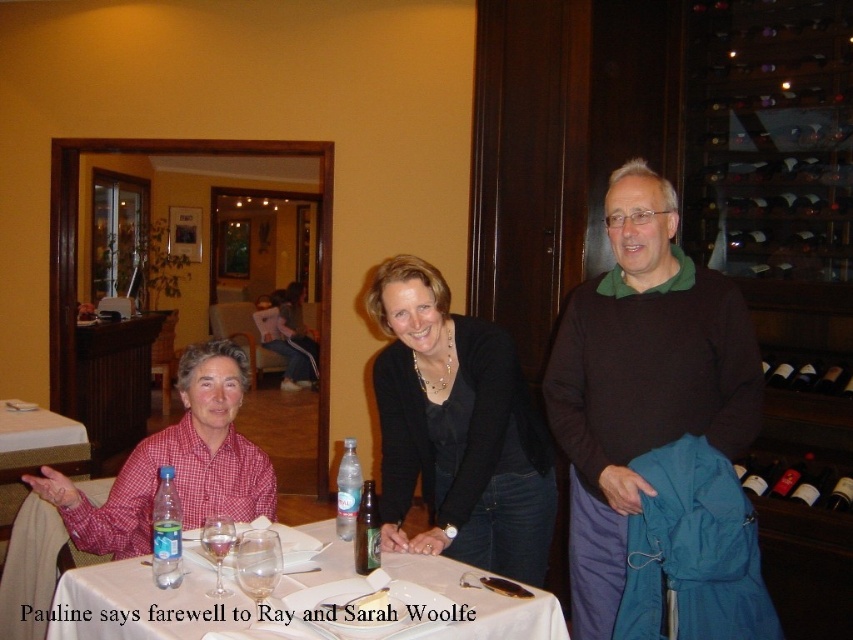
Which is more to the right, matte black jacket at center or clear glass wine glass at table center?

Positioned to the right is matte black jacket at center.

Between matte black jacket at center and clear glass wine glass at table center, which one has less height?

clear glass wine glass at table center

Between point (759, 397) and point (248, 568), which one is positioned in front?

Positioned in front is point (248, 568).

You are a GUI agent. You are given a task and a screenshot of the screen. Output one action in this format:
    pyautogui.click(x=<x>, y=<y>)
    Task: Click on the matte black jacket at center
    This screenshot has width=853, height=640.
    Given the screenshot: What is the action you would take?
    pyautogui.click(x=659, y=412)

Is clear glass wine glass at table center thinner than transparent glass at table center?

No.

Is point (257, 532) positioned before point (209, 536)?

No, (257, 532) is further to viewer.

At what (x,y) coordinates should I click in order to perform the action: click on clear glass wine glass at table center. Please return your answer as a coordinate pair (x, y). Image resolution: width=853 pixels, height=640 pixels. Looking at the image, I should click on (257, 564).

Does dark wood wine rack at right have a lesser height compared to dark brown glass wine bottle at right?

No.

Locate an element on the screen. This screenshot has height=640, width=853. dark wood wine rack at right is located at coordinates (772, 164).

This screenshot has width=853, height=640. What do you see at coordinates (772, 164) in the screenshot? I see `dark wood wine rack at right` at bounding box center [772, 164].

Identify the location of dark wood wine rack at right. The height and width of the screenshot is (640, 853). (772, 164).